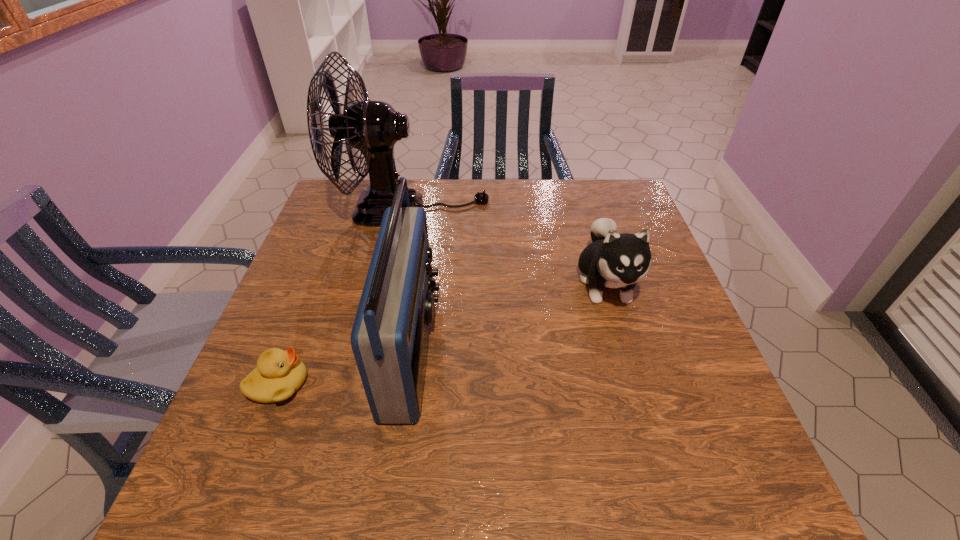
You are a GUI agent. You are given a task and a screenshot of the screen. Output one action in this format:
    pyautogui.click(x=<x>, y=<y>)
    Task: Click on the free space that satisfies the following two spatial constraints: 1. at the face of the rightmost object; 2. on the beak of the duckling
    The width and height of the screenshot is (960, 540).
    Given the screenshot: What is the action you would take?
    pyautogui.click(x=636, y=384)

At what (x,y) coordinates should I click in order to perform the action: click on vacant space that satisfies the following two spatial constraints: 1. at the face of the puppy; 2. on the beak of the shortest object. Please return your answer as a coordinate pair (x, y). This screenshot has width=960, height=540. Looking at the image, I should click on (636, 384).

I want to click on vacant point that satisfies the following two spatial constraints: 1. at the face of the puppy; 2. on the beak of the duckling, so click(x=636, y=384).

Identify the location of free space that satisfies the following two spatial constraints: 1. at the face of the puppy; 2. on the beak of the duckling. coord(636,384).

Identify the location of vacant space that satisfies the following two spatial constraints: 1. at the face of the third tallest object; 2. on the beak of the duckling. (636, 384).